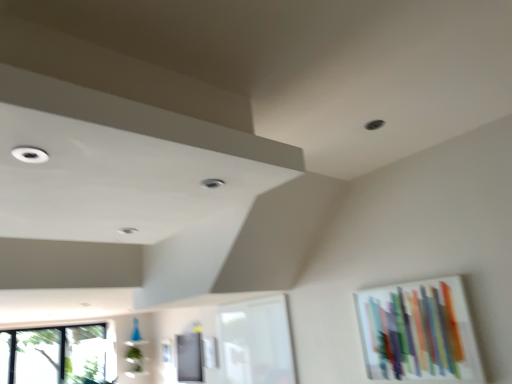
Question: Can you confirm if white glass window frame at center is bigger than transparent glass window at lower left?

Choices:
 (A) yes
 (B) no

Answer: (B)

Question: From a real-world perspective, is white glass window frame at center beneath transparent glass window at lower left?

Choices:
 (A) yes
 (B) no

Answer: (B)

Question: Is transparent glass window at lower left at the back of white glass window frame at center?

Choices:
 (A) yes
 (B) no

Answer: (B)

Question: Is white glass window frame at center far from transparent glass window at lower left?

Choices:
 (A) yes
 (B) no

Answer: (A)

Question: Is white glass window frame at center to the left of transparent glass window at lower left from the viewer's perspective?

Choices:
 (A) no
 (B) yes

Answer: (A)

Question: Can you confirm if white glass window frame at center is smaller than transparent glass window at lower left?

Choices:
 (A) yes
 (B) no

Answer: (A)

Question: Considering the relative sizes of white glass window frame at center and translucent glass artwork at upper right in the image provided, is white glass window frame at center wider than translucent glass artwork at upper right?

Choices:
 (A) no
 (B) yes

Answer: (B)

Question: Does white glass window frame at center have a lesser width compared to translucent glass artwork at upper right?

Choices:
 (A) yes
 (B) no

Answer: (B)

Question: From a real-world perspective, is white glass window frame at center located higher than translucent glass artwork at upper right?

Choices:
 (A) no
 (B) yes

Answer: (B)

Question: From the image's perspective, does white glass window frame at center appear lower than translucent glass artwork at upper right?

Choices:
 (A) yes
 (B) no

Answer: (A)

Question: Is white glass window frame at center to the left of translucent glass artwork at upper right from the viewer's perspective?

Choices:
 (A) yes
 (B) no

Answer: (A)

Question: Does white glass window frame at center come behind translucent glass artwork at upper right?

Choices:
 (A) no
 (B) yes

Answer: (B)

Question: From a real-world perspective, is transparent glass window at lower left on white glass window frame at center?

Choices:
 (A) no
 (B) yes

Answer: (A)